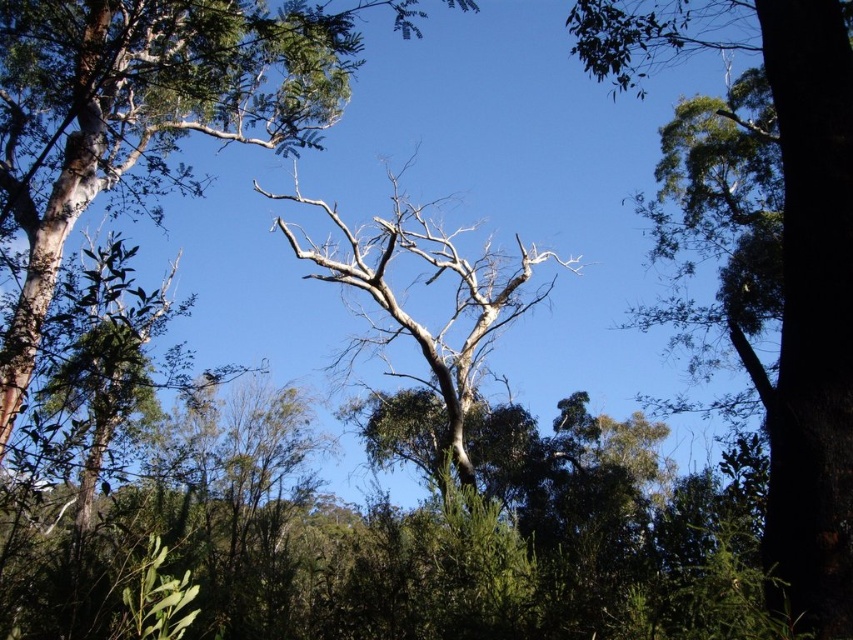
You are a hiker trying to identify landmarks in the forest. You see a smooth bark tree at center and a green leafy tree at upper right. Which of these two trees is larger in size?

The smooth bark tree at center is bigger than the green leafy tree at upper right, so the smooth bark tree at center is the larger one.